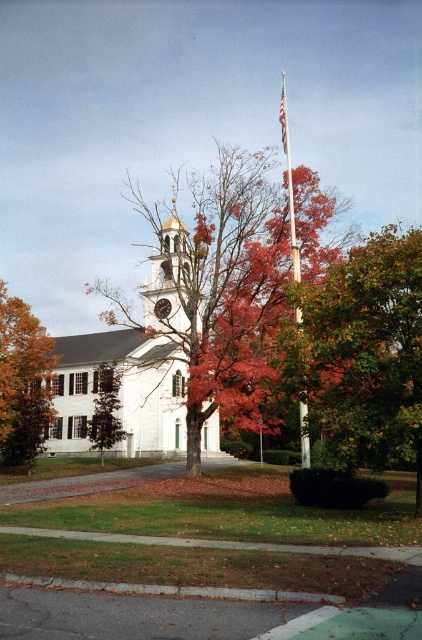
You are standing in front of the white colonial building and want to take a photo of both the orange leafy tree at left and the white fabric flag at center. Which object should you focus on first to ensure both are in the frame?

You should focus on the orange leafy tree at left first because it is closer to the viewer than the white fabric flag at center, so adjusting the camera to include it will naturally include the flag in the background.

You are a photographer planning to capture the autumn leaves at center and the white matte church at center in a single frame. Based on their positions, which object should you focus on first to ensure both are in the frame?

The autumn leaves at center is above the white matte church at center, so you should focus on the white matte church at center first to ensure both are in the frame.

You are standing in front of the white colonial building with a clock tower and looking at two points marked in the scene. The first point is at coordinates point (149,454) and the second is at point (113,372). Which point is closer to you?

Point (113,372) is closer to you because it is less further to the camera than point (149,454).